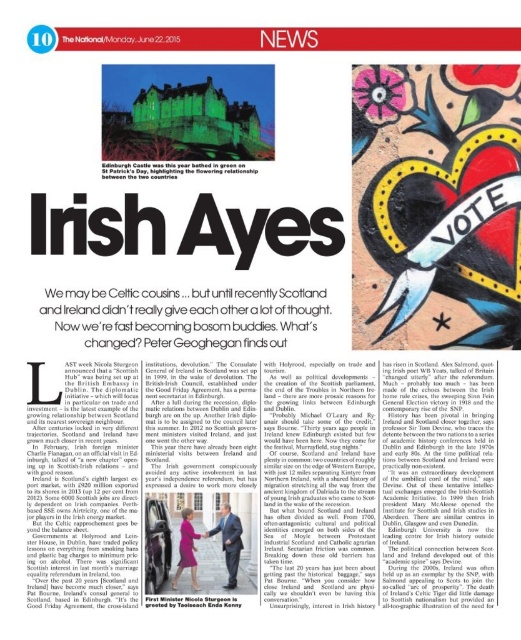
You are a graphic designer trying to place a new logo on the newspaper page. The logo must be placed exactly where the point at point (437, 204) is located. What object will the logo overlap with?

The point (437, 204) is on the vivid acrylic heart at center, so placing the logo there will overlap with the vivid acrylic heart at center.

In the scene shown: You are a photographer standing at the bottom of the page looking at the newspaper image. There are two points marked on the page at coordinates point (514, 205) and point (230, 522). Which point is closer to your eyes?

Point (514, 205) is closer to the viewer than point (230, 522).

You are a delivery robot trying to navigate to the smooth leather shoes at lower center. According to the newspaper layout, where should you move to find them?

The smooth leather shoes at lower center are located at point (x=229, y=541) on the newspaper layout.